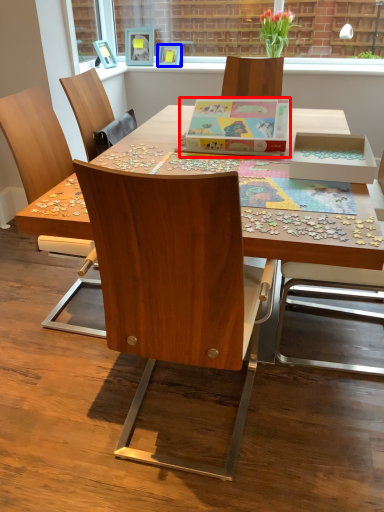
Question: Which object appears closest to the camera in this image, cardboard box (highlighted by a red box) or picture frame (highlighted by a blue box)?

Choices:
 (A) cardboard box
 (B) picture frame

Answer: (A)